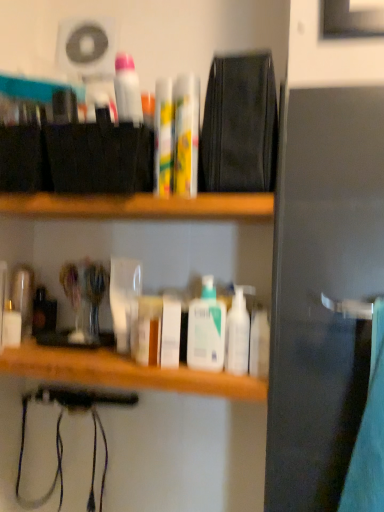
Question: Is white glossy bottles at center in front of wooden shelf at center?

Choices:
 (A) yes
 (B) no

Answer: (A)

Question: From a real-world perspective, is white glossy bottles at center positioned under wooden shelf at center based on gravity?

Choices:
 (A) yes
 (B) no

Answer: (A)

Question: Is white glossy bottles at center not close to wooden shelf at center?

Choices:
 (A) no
 (B) yes

Answer: (A)

Question: From the image's perspective, is white glossy bottles at center located beneath wooden shelf at center?

Choices:
 (A) no
 (B) yes

Answer: (B)

Question: Is white glossy bottles at center taller than wooden shelf at center?

Choices:
 (A) no
 (B) yes

Answer: (B)

Question: Does white glossy bottles at center have a greater width compared to wooden shelf at center?

Choices:
 (A) no
 (B) yes

Answer: (A)

Question: Can you confirm if clear glass jar at left, which appears as the 9th toiletry when viewed from the right, is taller than yellow-green plastic tubes at center, the 5th toiletry positioned from the left?

Choices:
 (A) no
 (B) yes

Answer: (A)

Question: Can you confirm if clear glass jar at left, which appears as the 9th toiletry when viewed from the right, is shorter than yellow-green plastic tubes at center, arranged as the 6th toiletry when viewed from the right?

Choices:
 (A) no
 (B) yes

Answer: (B)

Question: Are clear glass jar at left, placed as the 2th toiletry when sorted from left to right, and yellow-green plastic tubes at center, arranged as the 6th toiletry when viewed from the right, far apart?

Choices:
 (A) no
 (B) yes

Answer: (A)

Question: Is clear glass jar at left, placed as the 2th toiletry when sorted from left to right, turned away from yellow-green plastic tubes at center, the 5th toiletry positioned from the left?

Choices:
 (A) no
 (B) yes

Answer: (A)

Question: Is clear glass jar at left, which appears as the 9th toiletry when viewed from the right, smaller than yellow-green plastic tubes at center, arranged as the 6th toiletry when viewed from the right?

Choices:
 (A) no
 (B) yes

Answer: (B)

Question: Does clear glass jar at left, which appears as the 9th toiletry when viewed from the right, have a lesser width compared to yellow-green plastic tubes at center, the 5th toiletry positioned from the left?

Choices:
 (A) no
 (B) yes

Answer: (A)

Question: From a real-world perspective, does yellow matte tube at center, placed as the seventh toiletry when sorted from left to right, stand above white glossy toothpaste at upper center?

Choices:
 (A) yes
 (B) no

Answer: (B)